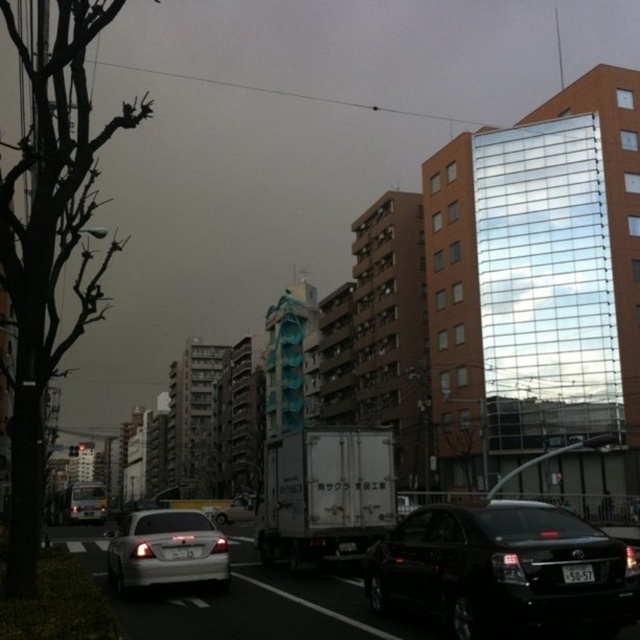
You are a pedestrian standing on the sidewalk and see the silver metallic car at center and the black plastic license plate at center. Which object is closer to the left side of the frame?

The silver metallic car at center is to the left of the black plastic license plate at center, so it is closer to the left side of the frame.

You are a pedestrian standing at the edge of the road. You notice a brown leafless tree at left and a black plastic license plate at center. Which object is wider?

The brown leafless tree at left is wider than the black plastic license plate at center.